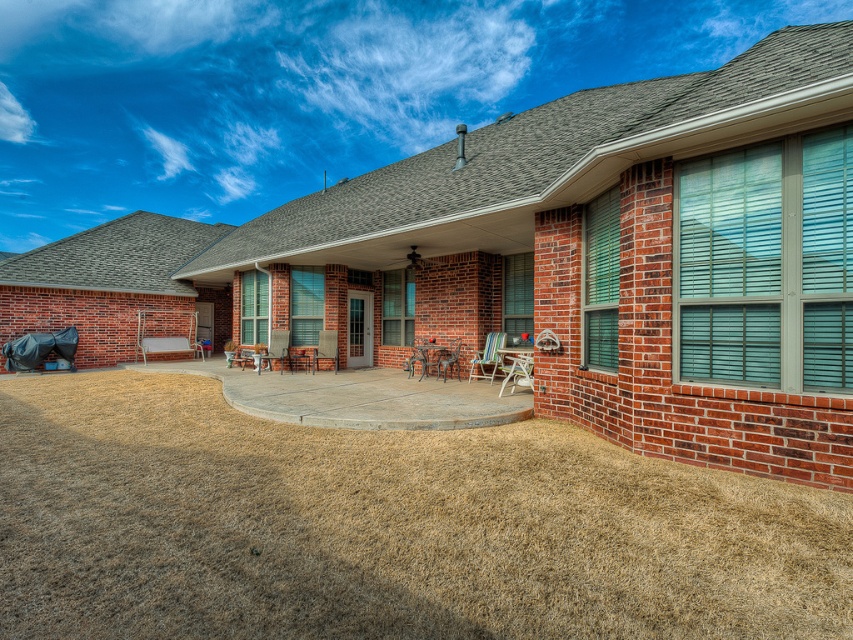
Question: Does multicolored plastic chair at center have a lesser width compared to metallic silver chair at center?

Choices:
 (A) yes
 (B) no

Answer: (B)

Question: Can you confirm if brown brick patio at center is bigger than metallic silver chair at center?

Choices:
 (A) yes
 (B) no

Answer: (A)

Question: Which object is positioned closest to the brown brick patio at center?

Choices:
 (A) multicolored plastic chair at center
 (B) brown grass at lower left

Answer: (A)

Question: Can you confirm if brown brick patio at center is thinner than brown grass at lower left?

Choices:
 (A) yes
 (B) no

Answer: (B)

Question: Estimate the real-world distances between objects in this image. Which object is closer to the brown grass at lower left?

Choices:
 (A) multicolored plastic chair at center
 (B) metallic brown chair at center
 (C) metallic silver chair at center
 (D) brown brick patio at center

Answer: (C)

Question: Estimate the real-world distances between objects in this image. Which object is closer to the brown brick patio at center?

Choices:
 (A) metallic brown chair at center
 (B) metallic silver chair at center
 (C) multicolored plastic chair at center

Answer: (C)